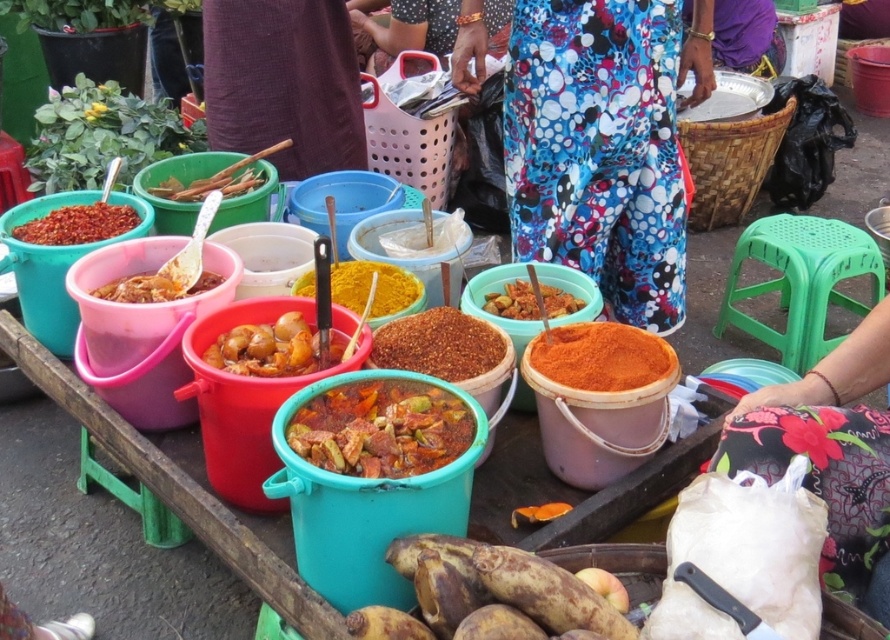
You are standing at the entrance of the market and see the floral fabric pants at center. Can you determine their exact position relative to the entrance?

The floral fabric pants at center are located at coordinates point (597, 148), so they are positioned approximately 23.4 percent from the left edge and 67.3 percent from the top edge of the market scene.